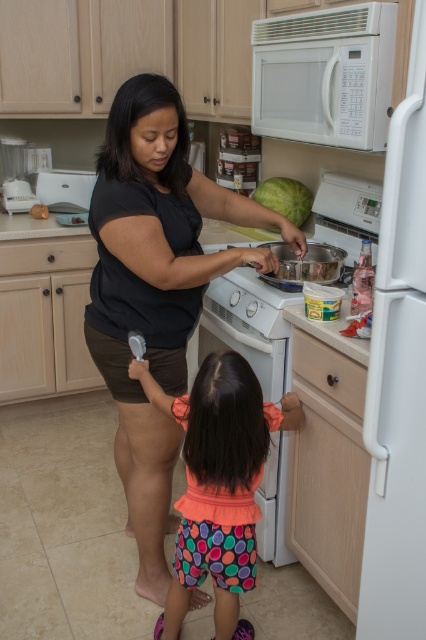
Can you confirm if black matte shirt at center is shorter than green matte watermelon at upper center?

No.

What do you see at coordinates (155, 289) in the screenshot?
I see `black matte shirt at center` at bounding box center [155, 289].

Between point (161, 163) and point (276, 198), which one is positioned behind?

Point (276, 198)

This screenshot has width=426, height=640. I want to click on black matte shirt at center, so click(x=155, y=289).

Can you confirm if black matte shirt at center is positioned below multicolored fabric shorts at lower center?

No, black matte shirt at center is not below multicolored fabric shorts at lower center.

Between black matte shirt at center and multicolored fabric shorts at lower center, which one appears on the right side from the viewer's perspective?

From the viewer's perspective, multicolored fabric shorts at lower center appears more on the right side.

Which is in front, point (180, 275) or point (236, 451)?

Point (236, 451)

Identify the location of black matte shirt at center. (155, 289).

Is white matte microwave at upper center smaller than green matte watermelon at upper center?

No.

This screenshot has width=426, height=640. In order to click on white matte microwave at upper center in this screenshot , I will do `click(325, 76)`.

Between point (342, 10) and point (291, 192), which one is positioned in front?

Positioned in front is point (342, 10).

The image size is (426, 640). Find the location of `white matte microwave at upper center`. white matte microwave at upper center is located at coordinates (325, 76).